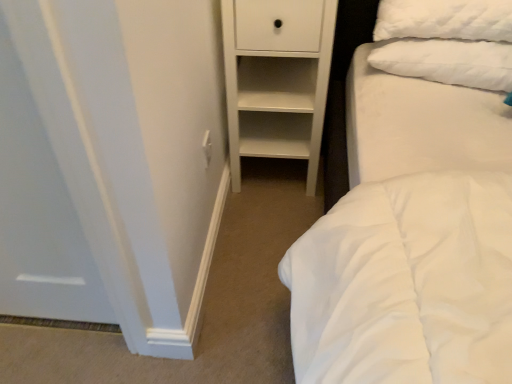
Question: Relative to white fluffy pillow at upper right, is white matte chest of drawers at center in front or behind?

Choices:
 (A) behind
 (B) front

Answer: (B)

Question: Looking at the image, does white matte chest of drawers at center seem bigger or smaller compared to white fluffy pillow at upper right?

Choices:
 (A) big
 (B) small

Answer: (A)

Question: Which is nearer to the white fluffy pillow at upper right?

Choices:
 (A) white plastic electric outlet at center
 (B) white matte chest of drawers at center

Answer: (B)

Question: Which object is positioned closest to the white matte chest of drawers at center?

Choices:
 (A) white plastic electric outlet at center
 (B) white fluffy pillow at upper right

Answer: (B)